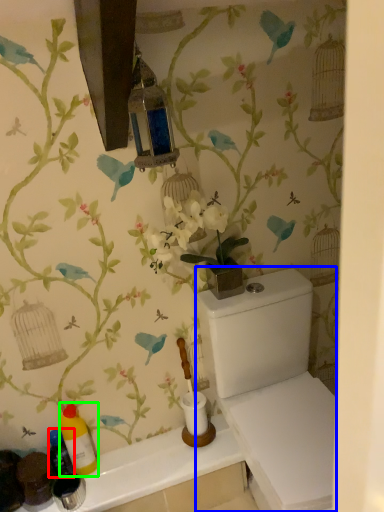
Question: Which object is the closest to the bottle (highlighted by a red box)? Choose among these: porcelain (highlighted by a blue box) or bottle (highlighted by a green box).

Choices:
 (A) porcelain
 (B) bottle

Answer: (B)